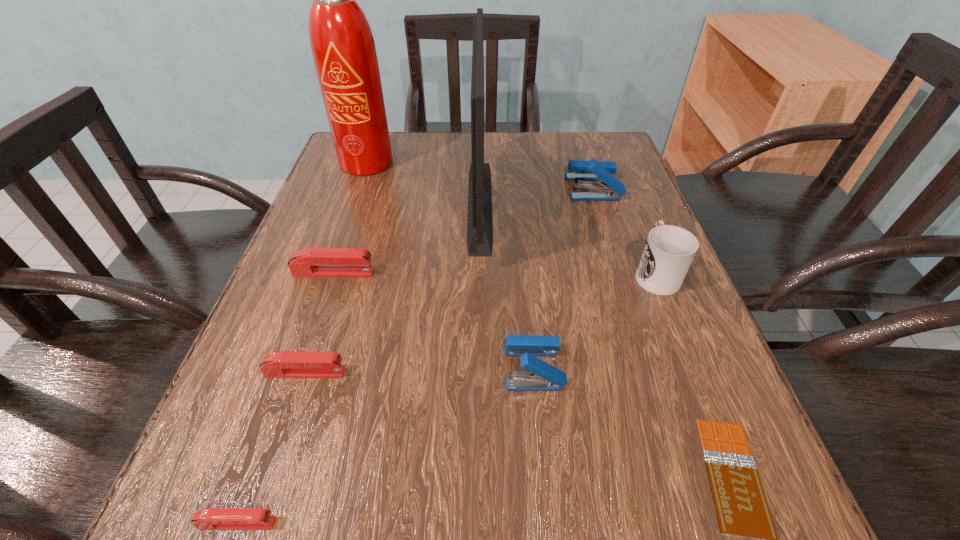
You are a GUI agent. You are given a task and a screenshot of the screen. Output one action in this format:
    pyautogui.click(x=<x>, y=<y>)
    Task: Click on the vacant area situated on the front of the tallest stapler
    The width and height of the screenshot is (960, 540).
    Given the screenshot: What is the action you would take?
    (602, 215)

This screenshot has height=540, width=960. Identify the location of free space located on the left of the smaller blue stapler. 297,368.

At what (x,y) coordinates should I click in order to perform the action: click on free space located on the front-facing side of the sixth tallest object. Please return your answer as a coordinate pair (x, y). This screenshot has width=960, height=540. Looking at the image, I should click on (533, 273).

The image size is (960, 540). What are the coordinates of `free point located on the front-facing side of the fourth tallest stapler` in the screenshot? It's located at (482, 373).

This screenshot has width=960, height=540. I want to click on vacant region located on the front-facing side of the smallest red stapler, so click(559, 523).

Locate an element on the screen. The height and width of the screenshot is (540, 960). fire extinguisher that is at the far edge is located at coordinates (342, 44).

Find the location of a particular element. This screenshot has width=960, height=540. monitor situated at the far edge is located at coordinates (479, 222).

This screenshot has height=540, width=960. I want to click on stapler situated at the far edge, so click(592, 170).

Identify the location of object present at the near edge. The width and height of the screenshot is (960, 540). (213, 518).

You are a GUI agent. You are given a task and a screenshot of the screen. Output one action in this format:
    pyautogui.click(x=<x>, y=<y>)
    Task: Click on the fire extinguisher at the left edge
    
    Given the screenshot: What is the action you would take?
    pyautogui.click(x=342, y=44)